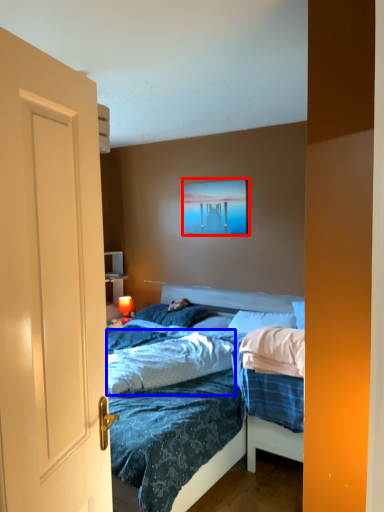
Question: Among these objects, which one is nearest to the camera, picture frame (highlighted by a red box) or sheet (highlighted by a blue box)?

Choices:
 (A) picture frame
 (B) sheet

Answer: (B)